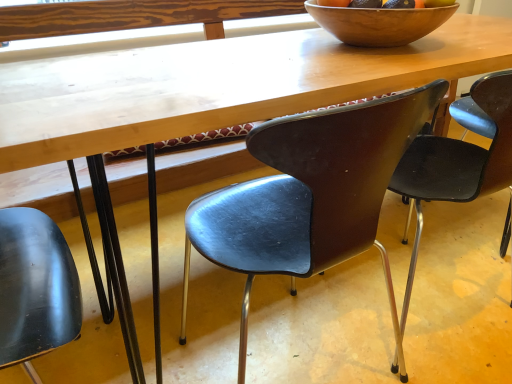
Question: Considering the relative sizes of matte black chair at center, the second chair viewed from the right, and wooden bowl at upper center in the image provided, is matte black chair at center, the second chair viewed from the right, bigger than wooden bowl at upper center?

Choices:
 (A) no
 (B) yes

Answer: (B)

Question: Considering the relative sizes of matte black chair at center, arranged as the second chair when viewed from the left, and wooden bowl at upper center in the image provided, is matte black chair at center, arranged as the second chair when viewed from the left, smaller than wooden bowl at upper center?

Choices:
 (A) no
 (B) yes

Answer: (A)

Question: Is matte black chair at center, the second chair viewed from the right, facing towards wooden bowl at upper center?

Choices:
 (A) yes
 (B) no

Answer: (B)

Question: From the image's perspective, is matte black chair at center, the second chair viewed from the right, under wooden bowl at upper center?

Choices:
 (A) no
 (B) yes

Answer: (B)

Question: Could wooden bowl at upper center be considered to be inside matte black chair at center, arranged as the second chair when viewed from the left?

Choices:
 (A) no
 (B) yes

Answer: (A)

Question: From a real-world perspective, is matte black chair at center, the second chair viewed from the right, positioned over wooden bowl at upper center based on gravity?

Choices:
 (A) yes
 (B) no

Answer: (B)

Question: From a real-world perspective, is matte brown chair at upper right, the first chair from the right, beneath matte black chair at lower left, the 3th chair when ordered from right to left?

Choices:
 (A) no
 (B) yes

Answer: (A)

Question: Are matte brown chair at upper right, the first chair from the right, and matte black chair at lower left, which is counted as the first chair, starting from the left, making contact?

Choices:
 (A) yes
 (B) no

Answer: (B)

Question: Does matte brown chair at upper right, the first chair from the right, appear on the right side of matte black chair at lower left, the 3th chair when ordered from right to left?

Choices:
 (A) no
 (B) yes

Answer: (B)

Question: Could matte black chair at lower left, the 3th chair when ordered from right to left, be considered to be inside matte brown chair at upper right, the first chair from the right?

Choices:
 (A) yes
 (B) no

Answer: (B)

Question: Does matte brown chair at upper right, which is the third chair in left-to-right order, lie behind matte black chair at lower left, the 3th chair when ordered from right to left?

Choices:
 (A) yes
 (B) no

Answer: (A)

Question: From the image's perspective, is matte brown chair at upper right, the first chair from the right, below matte black chair at lower left, the 3th chair when ordered from right to left?

Choices:
 (A) yes
 (B) no

Answer: (B)

Question: Can you confirm if wooden bowl at upper center is smaller than matte brown chair at upper right, which is the third chair in left-to-right order?

Choices:
 (A) yes
 (B) no

Answer: (A)